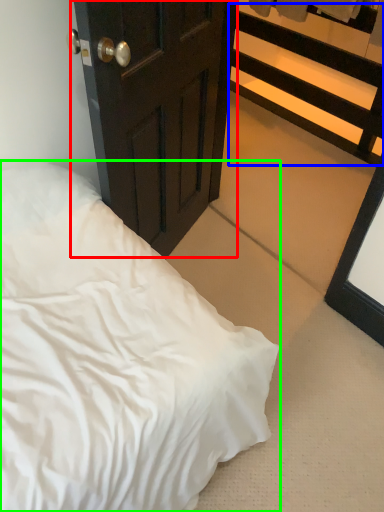
Question: Considering the real-world distances, which object is closest to door (highlighted by a red box)? balustrade (highlighted by a blue box) or bed (highlighted by a green box).

Choices:
 (A) balustrade
 (B) bed

Answer: (B)